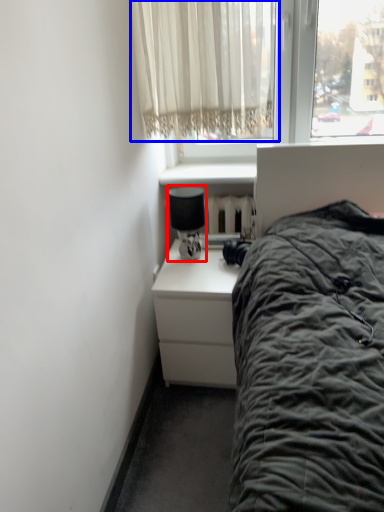
Question: Which object appears farthest to the camera in this image, lamp (highlighted by a red box) or curtain (highlighted by a blue box)?

Choices:
 (A) lamp
 (B) curtain

Answer: (A)